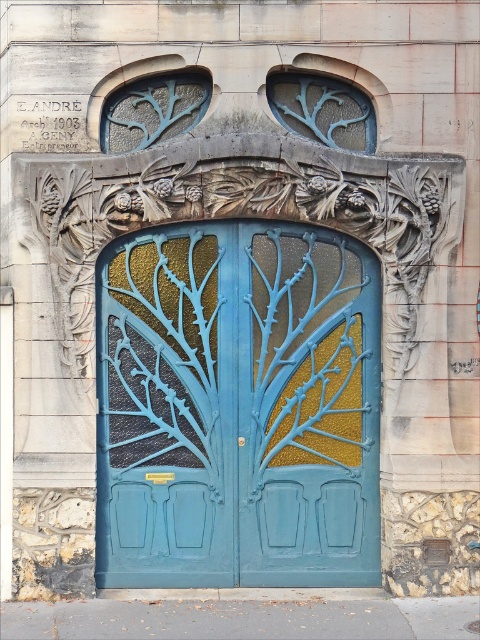
Question: Estimate the real-world distances between objects in this image. Which object is farther from the blue glass at upper center?

Choices:
 (A) matte blue metal door at center
 (B) translucent blue glass at upper left

Answer: (A)

Question: Based on their relative distances, which object is nearer to the matte blue metal door at center?

Choices:
 (A) translucent blue glass at upper left
 (B) blue glass at upper center

Answer: (B)

Question: Which object is the farthest from the matte blue metal door at center?

Choices:
 (A) blue glass at upper center
 (B) translucent blue glass at upper left

Answer: (B)

Question: Can you confirm if translucent blue glass at upper left is thinner than blue glass at upper center?

Choices:
 (A) no
 (B) yes

Answer: (B)

Question: Does matte blue metal door at center have a smaller size compared to blue glass at upper center?

Choices:
 (A) no
 (B) yes

Answer: (A)

Question: Can you confirm if matte blue metal door at center is bigger than blue glass at upper center?

Choices:
 (A) yes
 (B) no

Answer: (A)